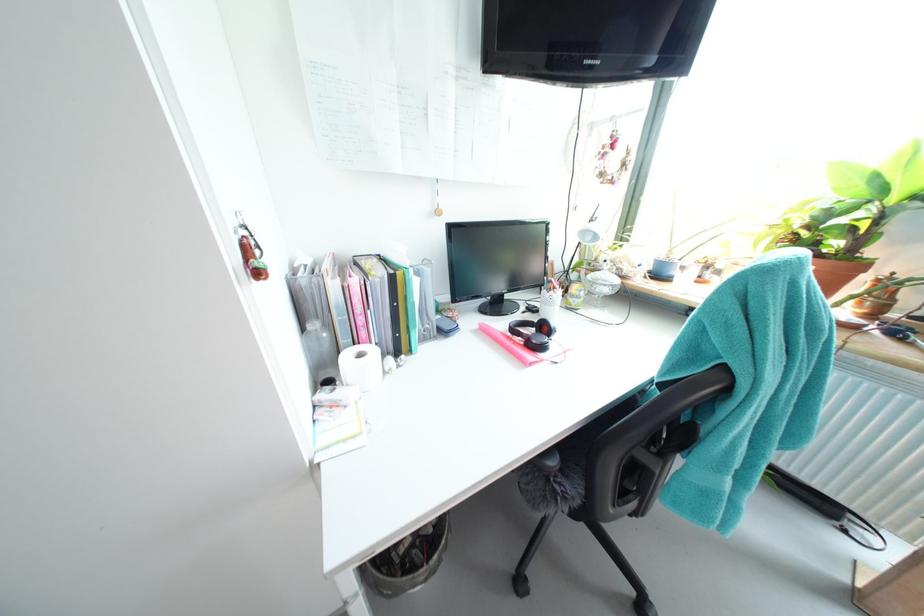
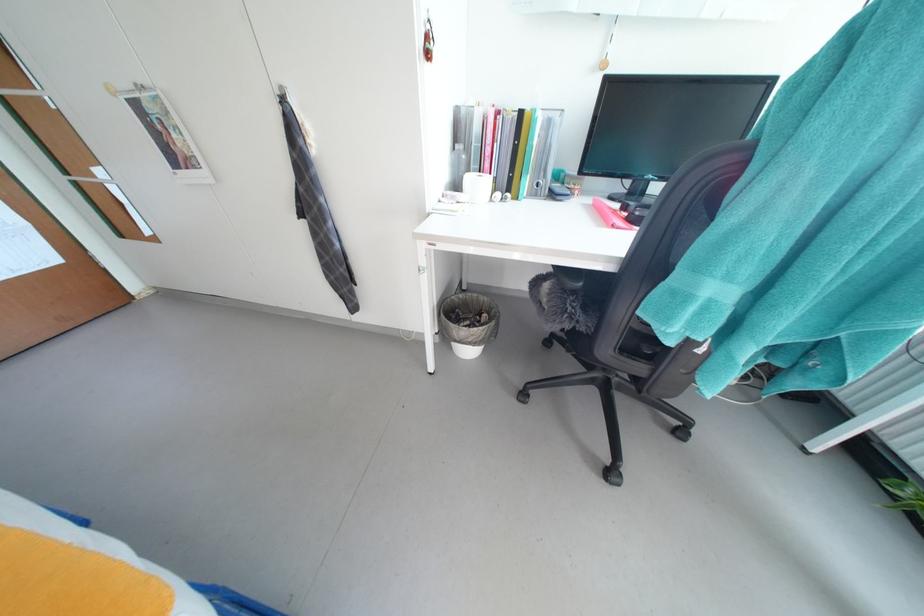
In the second image, find the point that corresponds to point (484, 329) in the first image.

(599, 204)